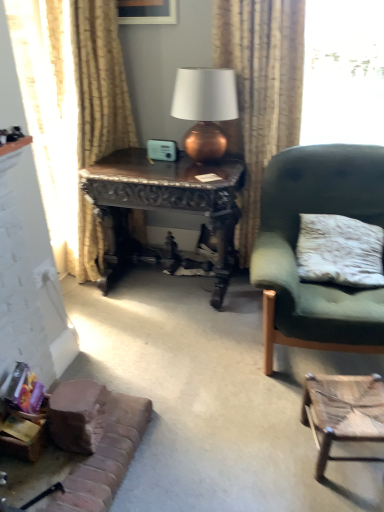
Question: Can you confirm if dark wood carved desk at center is bigger than velvet green armchair at right?

Choices:
 (A) no
 (B) yes

Answer: (A)

Question: From the image's perspective, is dark wood carved desk at center located above velvet green armchair at right?

Choices:
 (A) yes
 (B) no

Answer: (A)

Question: Considering the relative positions of dark wood carved desk at center and velvet green armchair at right in the image provided, is dark wood carved desk at center behind velvet green armchair at right?

Choices:
 (A) yes
 (B) no

Answer: (A)

Question: Can we say dark wood carved desk at center lies outside velvet green armchair at right?

Choices:
 (A) no
 (B) yes

Answer: (B)

Question: Is dark wood carved desk at center beside velvet green armchair at right?

Choices:
 (A) yes
 (B) no

Answer: (B)

Question: Is velvet green armchair at right inside the boundaries of brown fabric couch at lower left, or outside?

Choices:
 (A) outside
 (B) inside

Answer: (A)

Question: Considering the positions of velvet green armchair at right and brown fabric couch at lower left in the image, is velvet green armchair at right bigger or smaller than brown fabric couch at lower left?

Choices:
 (A) small
 (B) big

Answer: (B)

Question: From the image's perspective, is velvet green armchair at right above or below brown fabric couch at lower left?

Choices:
 (A) below
 (B) above

Answer: (B)

Question: Is velvet green armchair at right taller or shorter than brown fabric couch at lower left?

Choices:
 (A) short
 (B) tall

Answer: (B)

Question: Looking at the image, does brown fabric couch at lower left seem bigger or smaller compared to dark wood carved desk at center?

Choices:
 (A) small
 (B) big

Answer: (A)

Question: Based on their positions, is brown fabric couch at lower left located to the left or right of dark wood carved desk at center?

Choices:
 (A) left
 (B) right

Answer: (A)

Question: In terms of height, does brown fabric couch at lower left look taller or shorter compared to dark wood carved desk at center?

Choices:
 (A) short
 (B) tall

Answer: (A)

Question: Does point (44, 502) appear closer or farther from the camera than point (178, 159)?

Choices:
 (A) farther
 (B) closer

Answer: (B)

Question: From a real-world perspective, is wooden woven stool at lower right positioned above or below textured beige curtain at upper center, the second curtain in the left-to-right sequence?

Choices:
 (A) below
 (B) above

Answer: (A)

Question: Is point (319, 446) closer or farther from the camera than point (251, 202)?

Choices:
 (A) farther
 (B) closer

Answer: (B)